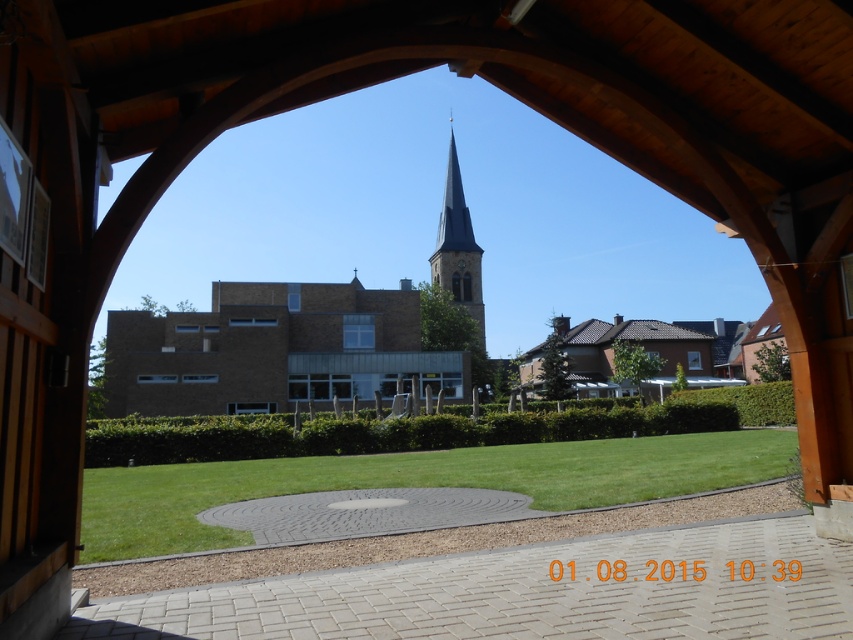
The height and width of the screenshot is (640, 853). What do you see at coordinates (276, 349) in the screenshot?
I see `brown brick church at center` at bounding box center [276, 349].

Is point (126, 403) farther from camera compared to point (462, 209)?

No, it is not.

Is point (146, 397) farther from viewer compared to point (454, 147)?

No.

Where is `brown brick church at center`? The height and width of the screenshot is (640, 853). brown brick church at center is located at coordinates (276, 349).

Does point (360, 387) lie in front of point (212, 484)?

No.

How far apart are brown brick church at center and green grass at center?

They are 30.21 meters apart.

Measure the distance between brown brick church at center and camera.

brown brick church at center and camera are 36.16 meters apart.

At what (x,y) coordinates should I click in order to perform the action: click on brown brick church at center. Please return your answer as a coordinate pair (x, y). The height and width of the screenshot is (640, 853). Looking at the image, I should click on (276, 349).

Can you confirm if green grass at center is positioned to the left of smooth gray steeple at center?

Incorrect, green grass at center is not on the left side of smooth gray steeple at center.

Which is more to the right, green grass at center or smooth gray steeple at center?

green grass at center is more to the right.

Describe the element at coordinates (415, 481) in the screenshot. I see `green grass at center` at that location.

Identify the location of green grass at center. (415, 481).